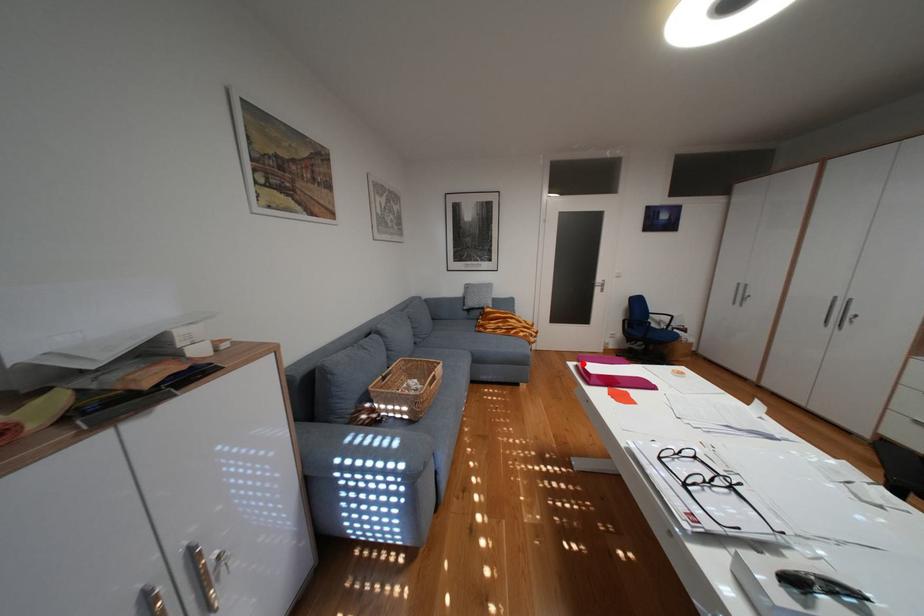
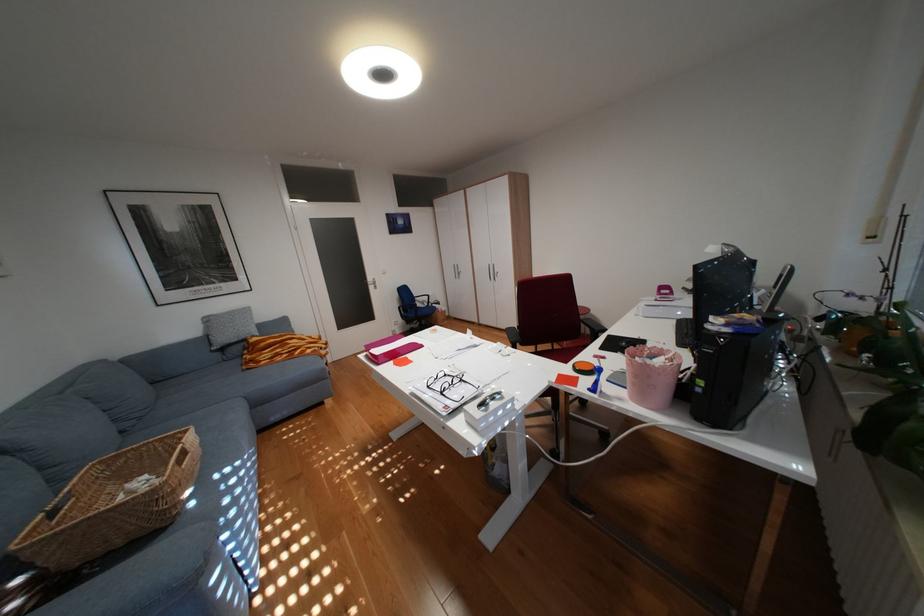
Question: I am providing you with two images of the same scene from different viewpoints. Given a red point in image1, look at the same physical point in image2. Is it:

Choices:
 (A) Closer to the viewpoint
 (B) Farther from the viewpoint

Answer: (B)